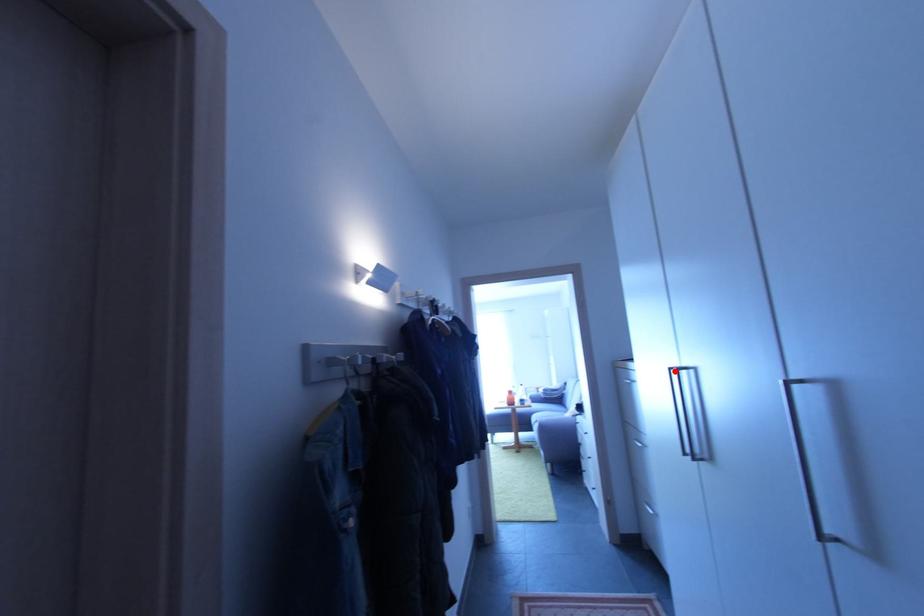
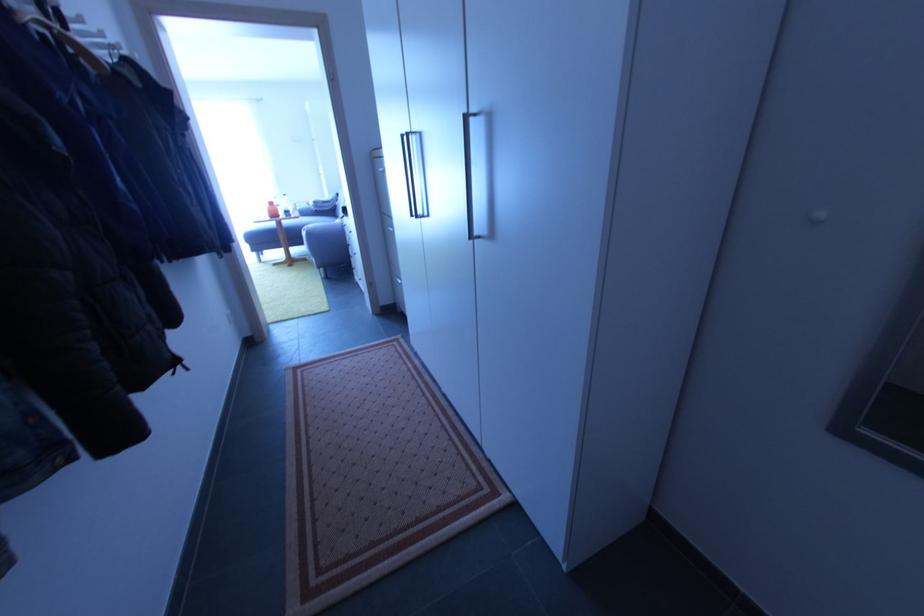
Locate, in the second image, the point that corresponds to the highlighted location in the first image.

(407, 138)